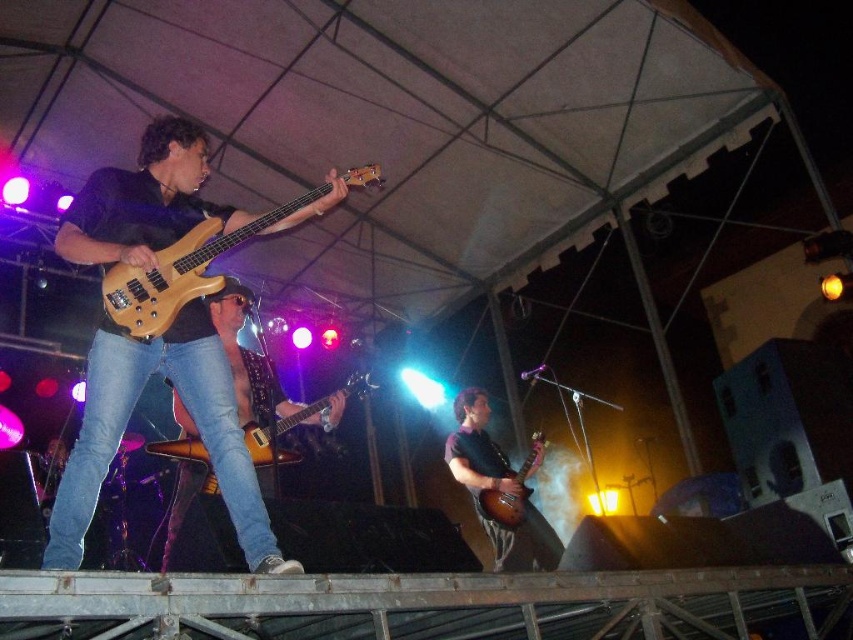
You are a stagehand setting up the equipment for the performance. You need to place a protective cover over both the matte wood bass guitar at left and the glossy wood guitar at center. Which guitar requires a taller cover?

The matte wood bass guitar at left requires a taller cover because it is much taller than the glossy wood guitar at center.

You are a stagehand setting up a new microphone stand. You need to place it exactly at point (189, 413), which is where the matte wood bass guitar at left is currently located. Can you move the bass guitar to a position that is 0.1 units to the right and 0.05 units upward from its current position without overlapping with any other objects?

The matte wood bass guitar at left can be moved 0.1 units to the right and 0.05 units upward from its current position at point (189, 413) to the new coordinates of 0.748, 0.272. Since there is no mention of other objects in that area, it should be possible to move it there without overlapping.

You are a stagehand setting up for a concert and need to place a new microphone stand between the matte wood bass guitar at left and the wooden electric guitar at center. Based on their positions, where should you position the new microphone stand?

The new microphone stand should be placed between the matte wood bass guitar at left and the wooden electric guitar at center since the matte wood bass guitar at left is positioned to the left of the wooden electric guitar at center.